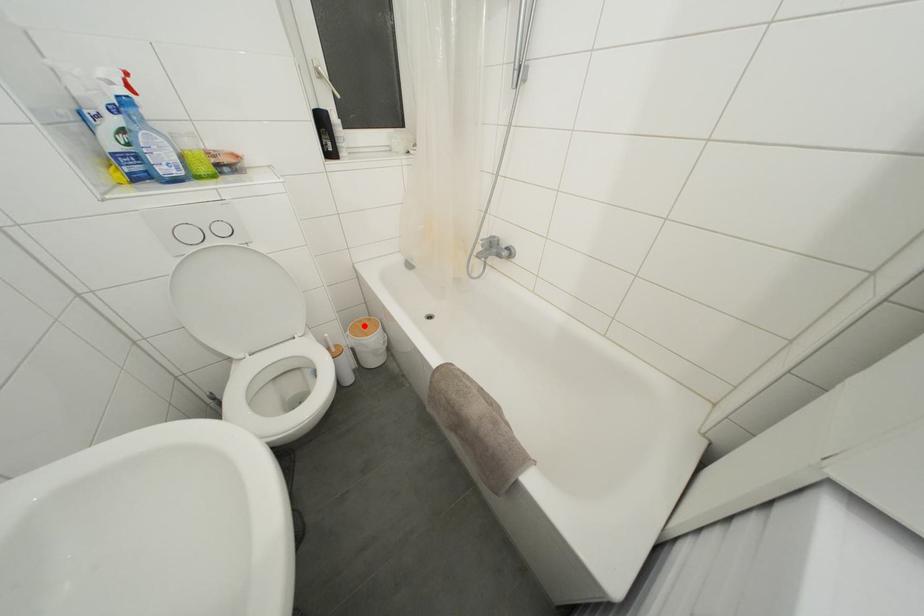
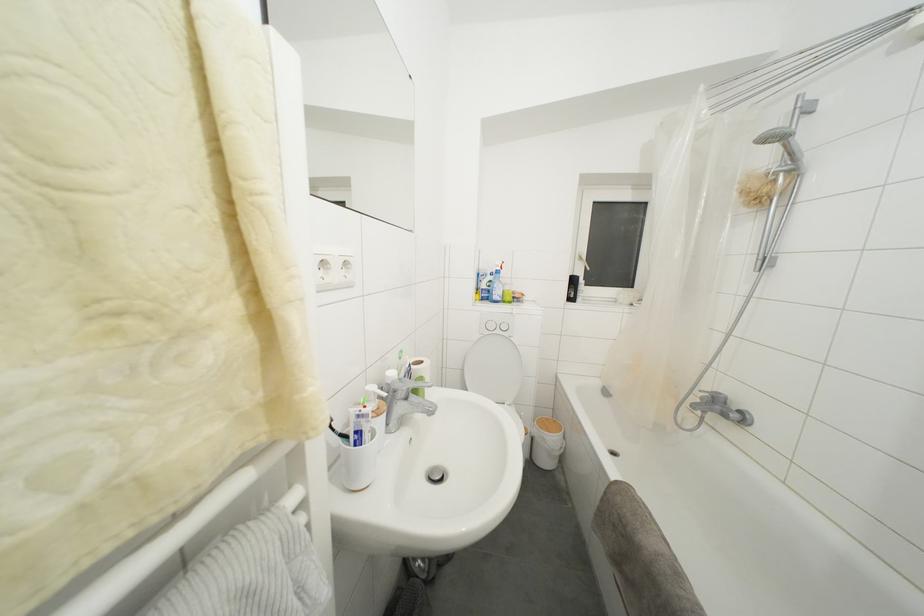
Question: I am providing you with two images of the same scene from different viewpoints. In image1, a red point is highlighted. Considering the same 3D point in image2, which of the following is correct?

Choices:
 (A) It is closer
 (B) It is farther

Answer: (B)